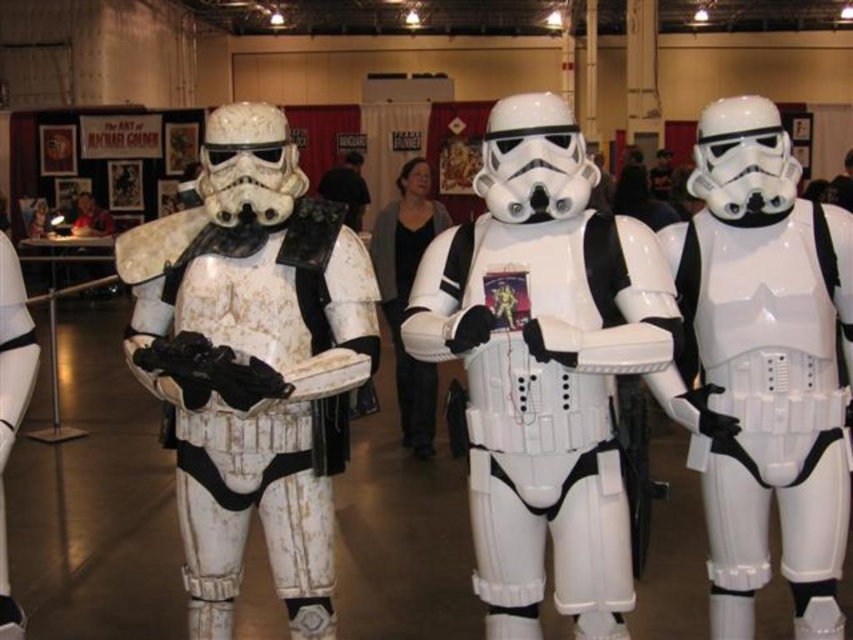
Between white plastic stormtrooper at center and white matte stormtrooper armor at center, which one appears on the left side from the viewer's perspective?

From the viewer's perspective, white matte stormtrooper armor at center appears more on the left side.

Between point (521, 100) and point (228, 518), which one is positioned in front?

Point (521, 100) is in front.

The height and width of the screenshot is (640, 853). I want to click on white plastic stormtrooper at center, so click(x=544, y=365).

Between white glossy stormtrooper at center and black matte shirt at center, which one has more height?

white glossy stormtrooper at center is taller.

Does point (769, 113) lie in front of point (360, 164)?

Yes.

Who is more forward, (718, 561) or (322, 193)?

Positioned in front is point (718, 561).

Where is `white glossy stormtrooper at center`? Image resolution: width=853 pixels, height=640 pixels. white glossy stormtrooper at center is located at coordinates (763, 368).

Is white matte helmet at center further to the viewer compared to black matte shirt at center?

No, it is not.

Who is higher up, white matte helmet at center or black matte shirt at center?

black matte shirt at center is higher up.

This screenshot has height=640, width=853. Describe the element at coordinates (408, 294) in the screenshot. I see `white matte helmet at center` at that location.

Where is `white matte helmet at center`? white matte helmet at center is located at coordinates (408, 294).